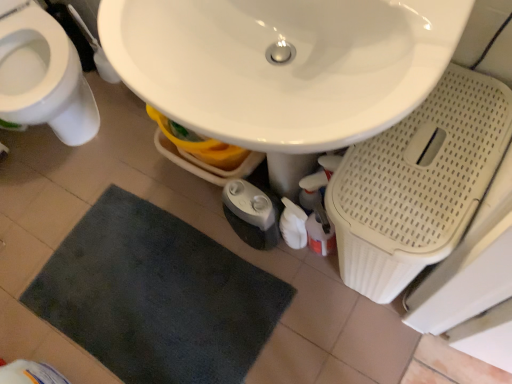
Question: Can you confirm if dark gray plush bath mat at lower center is bigger than white glossy sink at center?

Choices:
 (A) yes
 (B) no

Answer: (B)

Question: Considering the relative sizes of dark gray plush bath mat at lower center and white glossy sink at center in the image provided, is dark gray plush bath mat at lower center wider than white glossy sink at center?

Choices:
 (A) no
 (B) yes

Answer: (B)

Question: Does dark gray plush bath mat at lower center appear on the left side of white glossy sink at center?

Choices:
 (A) no
 (B) yes

Answer: (B)

Question: Considering the relative sizes of dark gray plush bath mat at lower center and white glossy sink at center in the image provided, is dark gray plush bath mat at lower center thinner than white glossy sink at center?

Choices:
 (A) no
 (B) yes

Answer: (A)

Question: Considering the relative sizes of dark gray plush bath mat at lower center and white glossy sink at center in the image provided, is dark gray plush bath mat at lower center shorter than white glossy sink at center?

Choices:
 (A) no
 (B) yes

Answer: (B)

Question: From a real-world perspective, relative to white glossy toilet at left, is white glossy sink at center vertically above or below?

Choices:
 (A) above
 (B) below

Answer: (A)

Question: Does point (217, 8) appear closer or farther from the camera than point (18, 97)?

Choices:
 (A) farther
 (B) closer

Answer: (B)

Question: Choose the correct answer: Is white glossy sink at center inside white glossy toilet at left or outside it?

Choices:
 (A) outside
 (B) inside

Answer: (A)

Question: Considering the positions of white glossy sink at center and white glossy toilet at left in the image, is white glossy sink at center wider or thinner than white glossy toilet at left?

Choices:
 (A) thin
 (B) wide

Answer: (A)

Question: Is point (41, 283) positioned closer to the camera than point (430, 14)?

Choices:
 (A) farther
 (B) closer

Answer: (A)

Question: Is dark gray plush bath mat at lower center wider or thinner than white glossy sink at center?

Choices:
 (A) thin
 (B) wide

Answer: (B)

Question: From the image's perspective, is dark gray plush bath mat at lower center located above or below white glossy sink at center?

Choices:
 (A) above
 (B) below

Answer: (B)

Question: From a real-world perspective, relative to white glossy sink at center, is dark gray plush bath mat at lower center vertically above or below?

Choices:
 (A) below
 (B) above

Answer: (A)

Question: Choose the correct answer: Is dark gray plush bath mat at lower center inside white glossy toilet at left or outside it?

Choices:
 (A) inside
 (B) outside

Answer: (B)

Question: In terms of size, does dark gray plush bath mat at lower center appear bigger or smaller than white glossy toilet at left?

Choices:
 (A) big
 (B) small

Answer: (B)